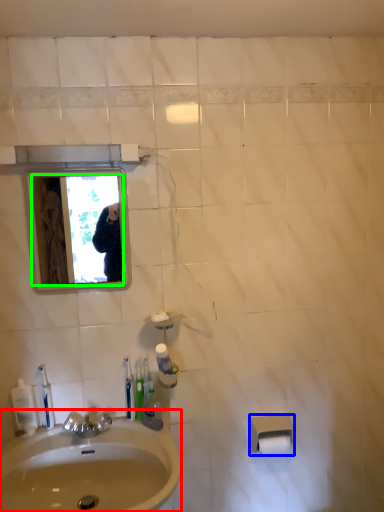
Question: Considering the real-world distances, which object is closest to sink (highlighted by a red box)? toilet paper (highlighted by a blue box) or mirror (highlighted by a green box).

Choices:
 (A) toilet paper
 (B) mirror

Answer: (A)